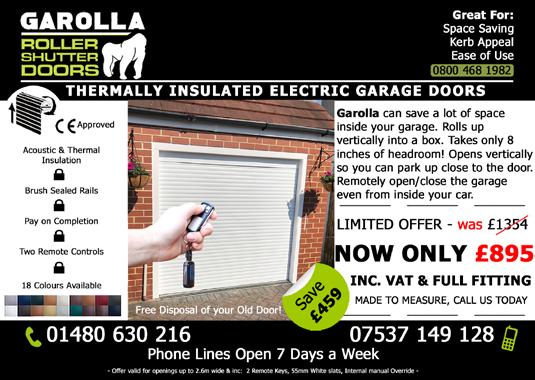
In order to click on hanging plant in this screenshot , I will do `click(141, 177)`, `click(322, 184)`.